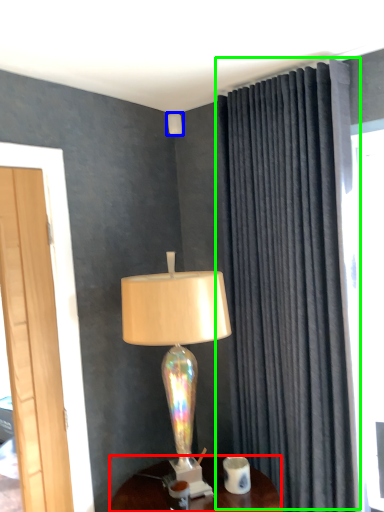
Question: Considering the real-world distances, which object is farthest from desk (highlighted by a red box)? lamp (highlighted by a blue box) or curtain (highlighted by a green box)?

Choices:
 (A) lamp
 (B) curtain

Answer: (A)